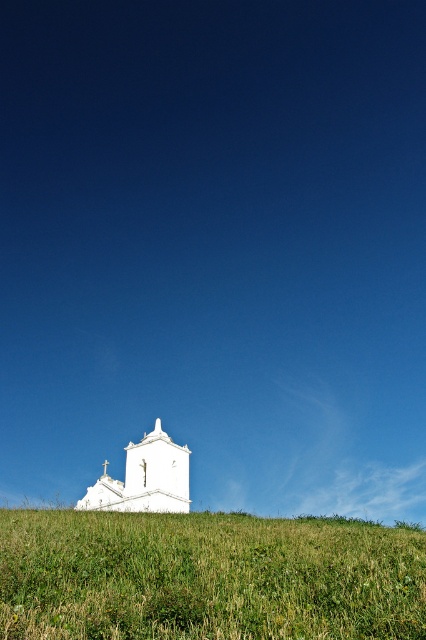
You are standing at the base of the hill looking up at the white church on top. There are two points marked on the hillside. Which of the two points, point (x=169, y=595) or point (x=166, y=442), is closer to your current position?

Point (x=169, y=595) is closer to the viewer than point (x=166, y=442).

You are standing on the green grassy hillside at lower center and want to reach the white smooth church at lower center. Which direction should you walk to get there?

The green grassy hillside at lower center is above the white smooth church at lower center, so you should walk downward to reach the white smooth church at lower center.